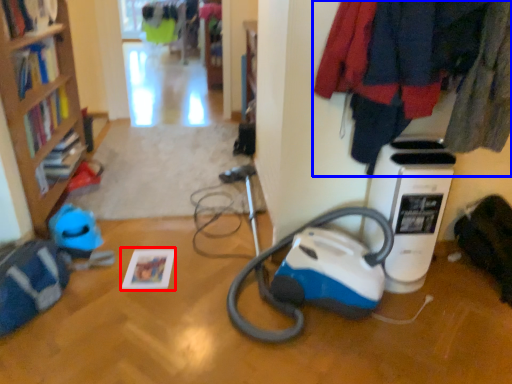
Question: Which object is further to the camera taking this photo, book (highlighted by a red box) or clothing (highlighted by a blue box)?

Choices:
 (A) book
 (B) clothing

Answer: (A)